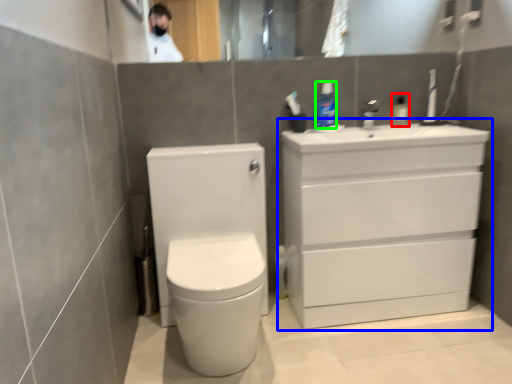
Question: Based on their relative distances, which object is nearer to toiletry (highlighted by a red box)? Choose from bathroom cabinet (highlighted by a blue box) and toiletry (highlighted by a green box).

Choices:
 (A) bathroom cabinet
 (B) toiletry

Answer: (B)